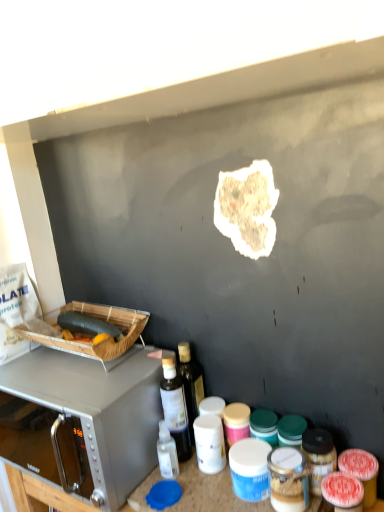
Where is `vacant space to the left of green matte zucchini at left, arranged as the 2th food when viewed from the front`? vacant space to the left of green matte zucchini at left, arranged as the 2th food when viewed from the front is located at coordinates (37, 361).